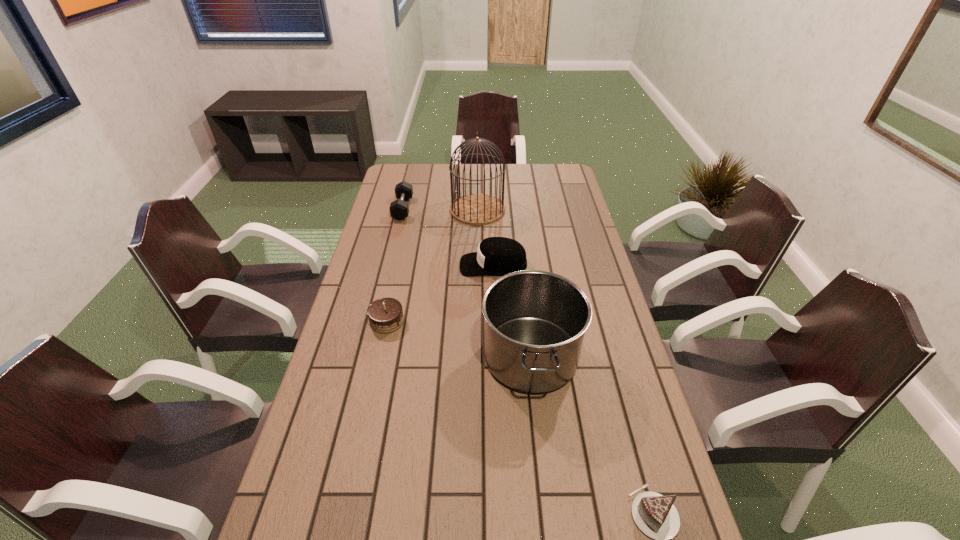
Find the location of a particular element. Image resolution: width=960 pixels, height=540 pixels. empty space that is in between the taller chocolate cake and the dumbbell is located at coordinates (395, 265).

Where is `free space between the dumbbell and the tallest object`? The width and height of the screenshot is (960, 540). free space between the dumbbell and the tallest object is located at coordinates (441, 209).

You are a GUI agent. You are given a task and a screenshot of the screen. Output one action in this format:
    pyautogui.click(x=<x>, y=<y>)
    Task: Click on the free space between the birdcage and the cap
    This screenshot has width=960, height=540.
    Given the screenshot: What is the action you would take?
    pyautogui.click(x=486, y=237)

At what (x,y) coordinates should I click in order to perform the action: click on vacant space in between the saucepan and the left chocolate cake. Please return your answer as a coordinate pair (x, y). Looking at the image, I should click on (459, 339).

Image resolution: width=960 pixels, height=540 pixels. What are the coordinates of `object that is the fourth closest to the birdcage` in the screenshot? It's located at (385, 315).

Identify which object is the fourth nearest to the nearest object. Please provide its 2D coordinates. Your answer should be formatted as a tuple, i.e. [(x, y)], where the tuple contains the x and y coordinates of a point satisfying the conditions above.

[(474, 209)]

Locate which chocolate cake is the closest to the cap. Please provide its 2D coordinates. Your answer should be formatted as a tuple, i.e. [(x, y)], where the tuple contains the x and y coordinates of a point satisfying the conditions above.

[(385, 315)]

What are the coordinates of `vacant region that satisfies the following two spatial constraints: 1. on the front-facing side of the fourth shortest object; 2. on the left side of the saucepan` in the screenshot? It's located at (497, 356).